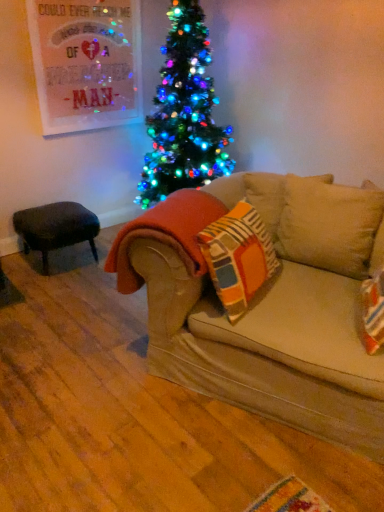
Identify the location of orange fleece blanket at center. (166, 234).

Would you consider orange fleece blanket at center to be distant from beige fabric couch at center?

Actually, orange fleece blanket at center and beige fabric couch at center are a little close together.

Can you confirm if orange fleece blanket at center is wider than beige fabric couch at center?

In fact, orange fleece blanket at center might be narrower than beige fabric couch at center.

Is orange fleece blanket at center not inside beige fabric couch at center?

Yes, orange fleece blanket at center is located beyond the bounds of beige fabric couch at center.

In terms of size, does orange fleece blanket at center appear bigger or smaller than beige fabric couch at center?

orange fleece blanket at center is smaller than beige fabric couch at center.

Considering the points (41, 206) and (178, 350), which point is behind, point (41, 206) or point (178, 350)?

The point (41, 206) is more distant.

Would you say velvet dark brown stool at left is to the left or to the right of beige fabric couch at center in the picture?

velvet dark brown stool at left is positioned on beige fabric couch at center's left side.

How distant is velvet dark brown stool at left from beige fabric couch at center?

velvet dark brown stool at left and beige fabric couch at center are 1.27 meters apart from each other.

Between point (225, 207) and point (51, 234), which one is positioned in front?

The point (225, 207) is closer to the camera.

Relative to velvet dark brown stool at left, is orange fleece blanket at center in front or behind?

In the image, orange fleece blanket at center appears in front of velvet dark brown stool at left.

In terms of size, does orange fleece blanket at center appear bigger or smaller than velvet dark brown stool at left?

orange fleece blanket at center is smaller than velvet dark brown stool at left.

Is orange fleece blanket at center to the left or to the right of velvet dark brown stool at left in the image?

Clearly, orange fleece blanket at center is on the right of velvet dark brown stool at left in the image.

Is beige fabric couch at center looking in the opposite direction of velvet dark brown stool at left?

Yes, velvet dark brown stool at left is at the back of beige fabric couch at center.

You are a GUI agent. You are given a task and a screenshot of the screen. Output one action in this format:
    pyautogui.click(x=<x>, y=<y>)
    Task: Click on the studio couch located on the right of velvet dark brown stool at left
    Image resolution: width=384 pixels, height=512 pixels.
    Given the screenshot: What is the action you would take?
    pyautogui.click(x=268, y=305)

Considering the relative sizes of beige fabric couch at center and velvet dark brown stool at left in the image provided, is beige fabric couch at center wider than velvet dark brown stool at left?

Correct, the width of beige fabric couch at center exceeds that of velvet dark brown stool at left.

Considering the sizes of beige fabric couch at center and velvet dark brown stool at left in the image, is beige fabric couch at center taller or shorter than velvet dark brown stool at left?

beige fabric couch at center is shorter than velvet dark brown stool at left.

Considering the sizes of objects beige fabric couch at center and orange fleece blanket at center in the image provided, who is bigger, beige fabric couch at center or orange fleece blanket at center?

beige fabric couch at center is bigger.

Can orange fleece blanket at center be found inside beige fabric couch at center?

No, orange fleece blanket at center is located outside of beige fabric couch at center.

Which of these two, beige fabric couch at center or orange fleece blanket at center, stands taller?

With more height is orange fleece blanket at center.

Between beige fabric couch at center and orange fleece blanket at center, which one appears on the left side from the viewer's perspective?

beige fabric couch at center is more to the left.

Would you say velvet dark brown stool at left is to the left or to the right of orange fleece blanket at center in the picture?

From the image, it's evident that velvet dark brown stool at left is to the left of orange fleece blanket at center.

Which is nearer, (64, 234) or (160, 219)?

The point (160, 219) is closer to the camera.

From a real-world perspective, is velvet dark brown stool at left on top of orange fleece blanket at center?

No, from a real-world perspective, velvet dark brown stool at left is not above orange fleece blanket at center.

Consider the image. Is velvet dark brown stool at left looking in the opposite direction of orange fleece blanket at center?

No, velvet dark brown stool at left is not facing the opposite direction of orange fleece blanket at center.

You are a GUI agent. You are given a task and a screenshot of the screen. Output one action in this format:
    pyautogui.click(x=<x>, y=<y>)
    Task: Click on the blanket above the beige fabric couch at center (from a real-world perspective)
    
    Given the screenshot: What is the action you would take?
    pyautogui.click(x=166, y=234)

The image size is (384, 512). What are the coordinates of `studio couch on the right of velvet dark brown stool at left` in the screenshot? It's located at (268, 305).

From the picture: From the image, which object appears to be farther from orange fleece blanket at center, velvet dark brown stool at left or beige fabric couch at center?

The object further to orange fleece blanket at center is velvet dark brown stool at left.

From the image, which object appears to be nearer to velvet dark brown stool at left, orange fleece blanket at center or beige fabric couch at center?

orange fleece blanket at center.

Based on their spatial positions, is orange fleece blanket at center or velvet dark brown stool at left closer to beige fabric couch at center?

orange fleece blanket at center lies closer to beige fabric couch at center than the other object.

Based on their spatial positions, is beige fabric couch at center or velvet dark brown stool at left closer to orange fleece blanket at center?

beige fabric couch at center is closer to orange fleece blanket at center.

Based on their spatial positions, is velvet dark brown stool at left or orange fleece blanket at center closer to beige fabric couch at center?

The object closer to beige fabric couch at center is orange fleece blanket at center.

Which object lies nearer to the anchor point velvet dark brown stool at left, beige fabric couch at center or orange fleece blanket at center?

orange fleece blanket at center.

Where is `blanket between beige fabric couch at center and velvet dark brown stool at left along the z-axis`? blanket between beige fabric couch at center and velvet dark brown stool at left along the z-axis is located at coordinates (166, 234).